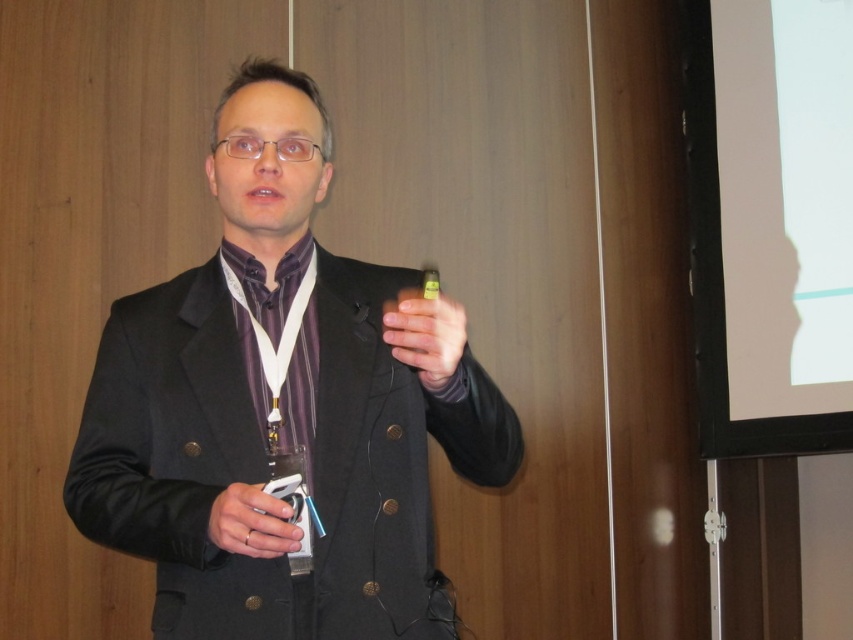
You are an attendee at a conference and notice the presenter holding two items. The presenter has a matte black pen at center and a matte black remote at lower left. Which item is located above the other?

The matte black pen at center is positioned over the matte black remote at lower left, so it is above the remote.

You are an event organizer setting up a presentation room. You notice the black matte suit at center and the matte black remote at lower left. Which object is more to the left?

The black matte suit at center is positioned on the left side of the matte black remote at lower left, so the black matte suit at center is more to the left.